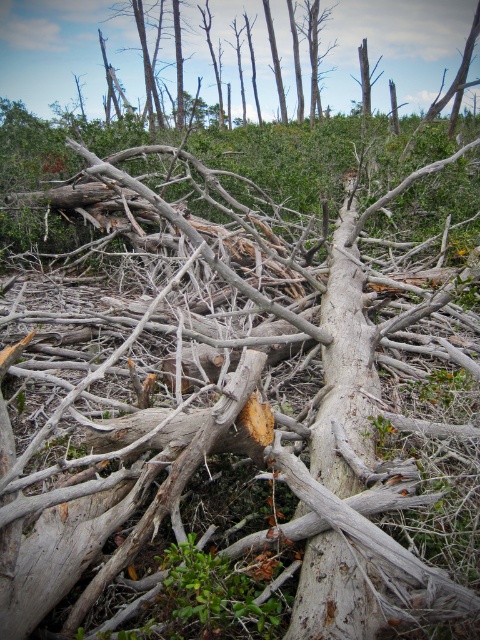
Question: Which of the following is the farthest from the observer?

Choices:
 (A) gray rough bark tree trunk at center
 (B) gray bark tree at upper center

Answer: (B)

Question: Does gray rough bark tree trunk at center come in front of gray bark tree at upper center?

Choices:
 (A) no
 (B) yes

Answer: (B)

Question: Can you confirm if gray rough bark tree trunk at center is thinner than gray bark tree at upper center?

Choices:
 (A) no
 (B) yes

Answer: (B)

Question: Does gray rough bark tree trunk at center appear over gray bark tree at upper center?

Choices:
 (A) no
 (B) yes

Answer: (A)